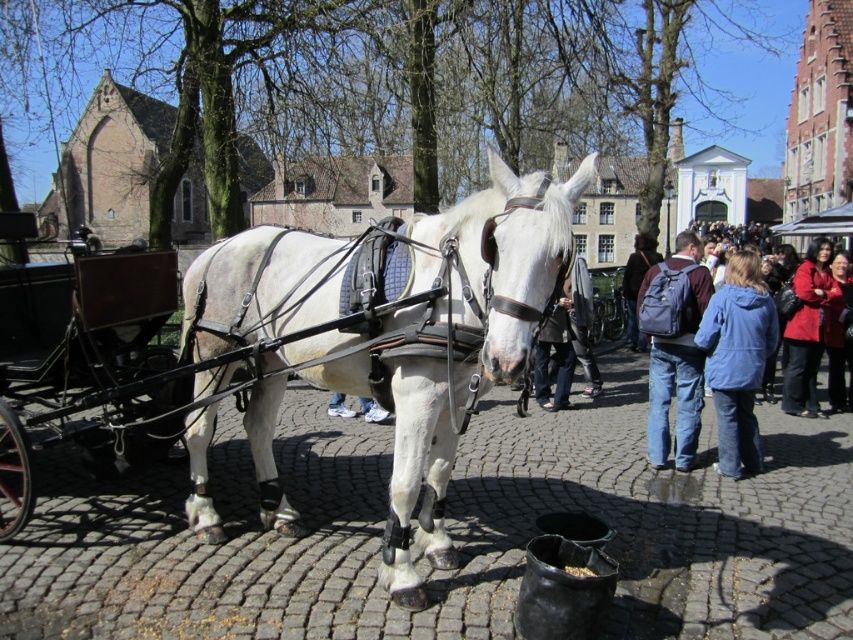
Question: Which object is the farthest from the white matte/suede horse at center?

Choices:
 (A) blue fleece jacket at lower right
 (B) red leather jacket at lower right

Answer: (B)

Question: Is denim backpack at center further to the viewer compared to red leather jacket at lower right?

Choices:
 (A) no
 (B) yes

Answer: (A)

Question: Which is farther from the denim backpack at center?

Choices:
 (A) dark brown backpack at center
 (B) red leather jacket at right

Answer: (A)

Question: Does white matte/suede horse at center have a smaller size compared to denim backpack at center?

Choices:
 (A) yes
 (B) no

Answer: (B)

Question: Considering the relative positions of white matte/suede horse at center and blue fleece jacket at lower right in the image provided, where is white matte/suede horse at center located with respect to blue fleece jacket at lower right?

Choices:
 (A) left
 (B) right

Answer: (A)

Question: Among these objects, which one is nearest to the camera?

Choices:
 (A) wooden cart at left
 (B) red leather jacket at right
 (C) dark brown backpack at center
 (D) blue fleece jacket at lower right

Answer: (A)